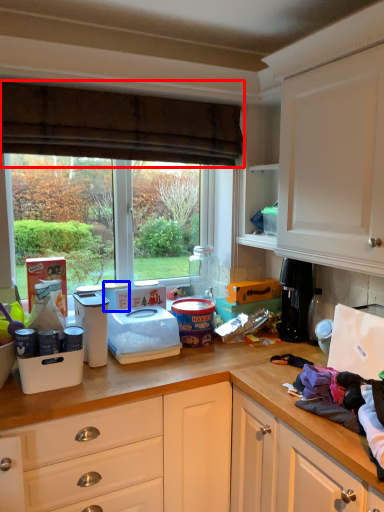
Question: Which of the following is the farthest to the observer, curtain (highlighted by a red box) or appliance (highlighted by a blue box)?

Choices:
 (A) curtain
 (B) appliance

Answer: (B)